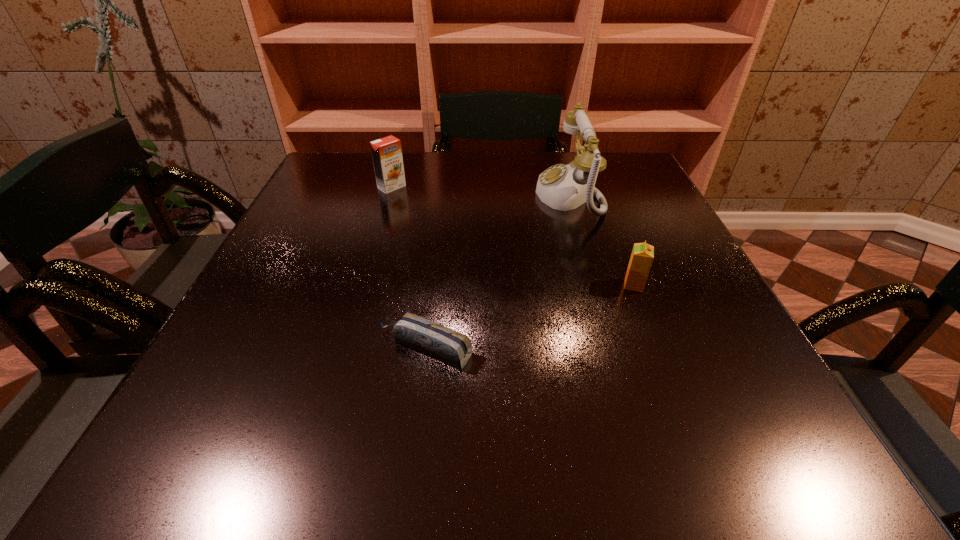
The image size is (960, 540). Find the location of `vacant space at the left edge of the desktop`. vacant space at the left edge of the desktop is located at coordinates 258,327.

Identify the location of vacant space at the right edge of the desktop. Image resolution: width=960 pixels, height=540 pixels. (640, 199).

What are the coordinates of `free space at the far left corner of the desktop` in the screenshot? It's located at (340, 164).

The width and height of the screenshot is (960, 540). I want to click on free space at the near left corner of the desktop, so click(x=150, y=453).

At what (x,y) coordinates should I click in order to perform the action: click on free space at the far right corner of the desktop. Please return your answer as a coordinate pair (x, y). Looking at the image, I should click on (615, 167).

Image resolution: width=960 pixels, height=540 pixels. I want to click on vacant space at the near right corner of the desktop, so click(x=786, y=459).

At what (x,y) coordinates should I click in order to perform the action: click on blank region between the farther orange juice and the telephone. Please return your answer as a coordinate pair (x, y). The height and width of the screenshot is (540, 960). Looking at the image, I should click on (480, 191).

Where is `empty space between the telephone and the nearer orange juice`? The width and height of the screenshot is (960, 540). empty space between the telephone and the nearer orange juice is located at coordinates (601, 240).

Where is `vacant area that lies between the second object from left to right and the shorter orange juice`? vacant area that lies between the second object from left to right and the shorter orange juice is located at coordinates (529, 317).

You are a GUI agent. You are given a task and a screenshot of the screen. Output one action in this format:
    pyautogui.click(x=<x>, y=<y>)
    Task: Click on the vacant space in between the telephone and the right orange juice
    This screenshot has height=540, width=960.
    Given the screenshot: What is the action you would take?
    pyautogui.click(x=601, y=240)